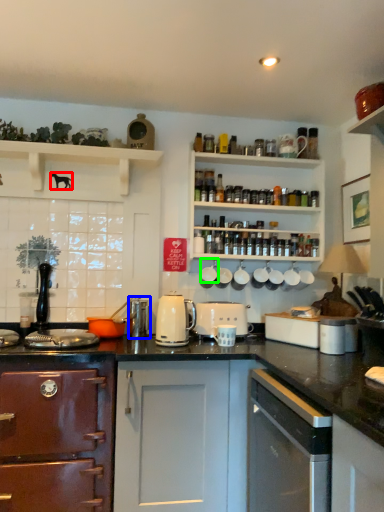
Question: Which object is the closest to the animal (highlighted by a red box)? Choose among these: appliance (highlighted by a blue box) or appliance (highlighted by a green box).

Choices:
 (A) appliance
 (B) appliance

Answer: (A)